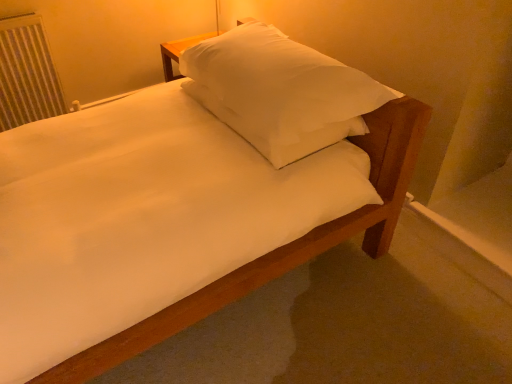
Question: Is white soft pillow at upper center facing towards white painted metal radiator at left?

Choices:
 (A) no
 (B) yes

Answer: (A)

Question: Is white soft pillow at upper center positioned with its back to white painted metal radiator at left?

Choices:
 (A) yes
 (B) no

Answer: (A)

Question: From a real-world perspective, does white soft pillow at upper center stand above white painted metal radiator at left?

Choices:
 (A) no
 (B) yes

Answer: (B)

Question: Considering the relative positions of white soft pillow at upper center and white painted metal radiator at left in the image provided, is white soft pillow at upper center to the left of white painted metal radiator at left from the viewer's perspective?

Choices:
 (A) no
 (B) yes

Answer: (A)

Question: Is white soft pillow at upper center located outside white painted metal radiator at left?

Choices:
 (A) yes
 (B) no

Answer: (A)

Question: Does white soft pillow at upper center contain white painted metal radiator at left?

Choices:
 (A) no
 (B) yes

Answer: (A)

Question: Considering the relative sizes of white painted metal radiator at left and white soft pillow at upper center in the image provided, is white painted metal radiator at left thinner than white soft pillow at upper center?

Choices:
 (A) yes
 (B) no

Answer: (A)

Question: From a real-world perspective, is white painted metal radiator at left over white soft pillow at upper center?

Choices:
 (A) yes
 (B) no

Answer: (B)

Question: Does white painted metal radiator at left have a lesser height compared to white soft pillow at upper center?

Choices:
 (A) yes
 (B) no

Answer: (B)

Question: From the image's perspective, would you say white painted metal radiator at left is positioned over white soft pillow at upper center?

Choices:
 (A) yes
 (B) no

Answer: (A)

Question: Is white painted metal radiator at left aimed at white soft pillow at upper center?

Choices:
 (A) yes
 (B) no

Answer: (B)

Question: Is white painted metal radiator at left outside of white soft pillow at upper center?

Choices:
 (A) no
 (B) yes

Answer: (B)

Question: Do you think white painted metal radiator at left is within white soft pillow at upper center, or outside of it?

Choices:
 (A) outside
 (B) inside

Answer: (A)